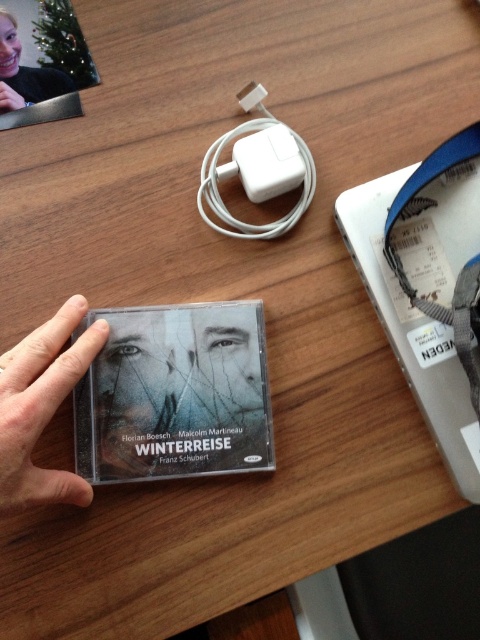
You are organizing items on a desk and need to place the white plastic charger at center and the matte black face at upper left. Based on their sizes, which one should you place first to ensure stability?

The white plastic charger at center is taller than the matte black face at upper left, so you should place the white plastic charger at center first to ensure stability.

You are an artist trying to sketch the scene. You notice two elements in the image, the smooth skin hand at lower left and the matte black face at upper left. Which one should you draw with a wider stroke to accurately represent their sizes in the image?

The smooth skin hand at lower left should be drawn with a wider stroke because its width is larger than the matte black face at upper left according to the description.